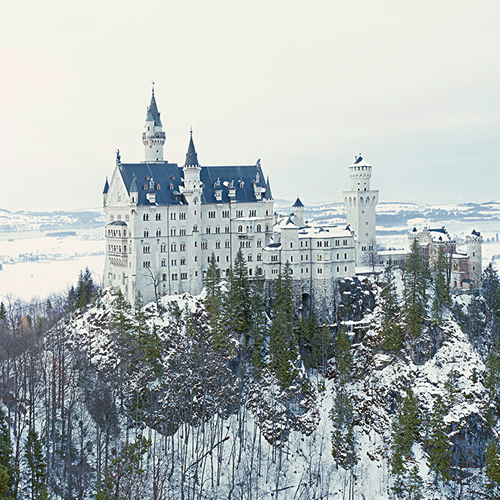
The image size is (500, 500). Find the location of `windows`. windows is located at coordinates (148, 233), (156, 218), (145, 216), (179, 231), (211, 214), (225, 216).